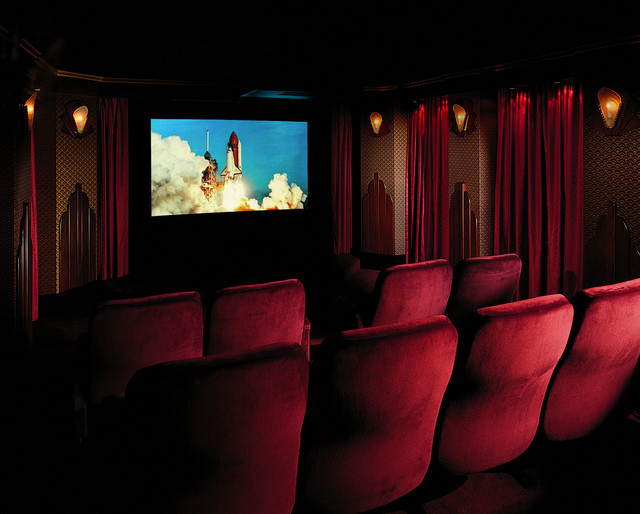
You are a GUI agent. You are given a task and a screenshot of the screen. Output one action in this format:
    pyautogui.click(x=<x>, y=<y>)
    Task: Click on the seat back
    
    Given the screenshot: What is the action you would take?
    pyautogui.click(x=625, y=343), pyautogui.click(x=507, y=376), pyautogui.click(x=400, y=409), pyautogui.click(x=265, y=440), pyautogui.click(x=164, y=339), pyautogui.click(x=244, y=323), pyautogui.click(x=409, y=295), pyautogui.click(x=500, y=281)